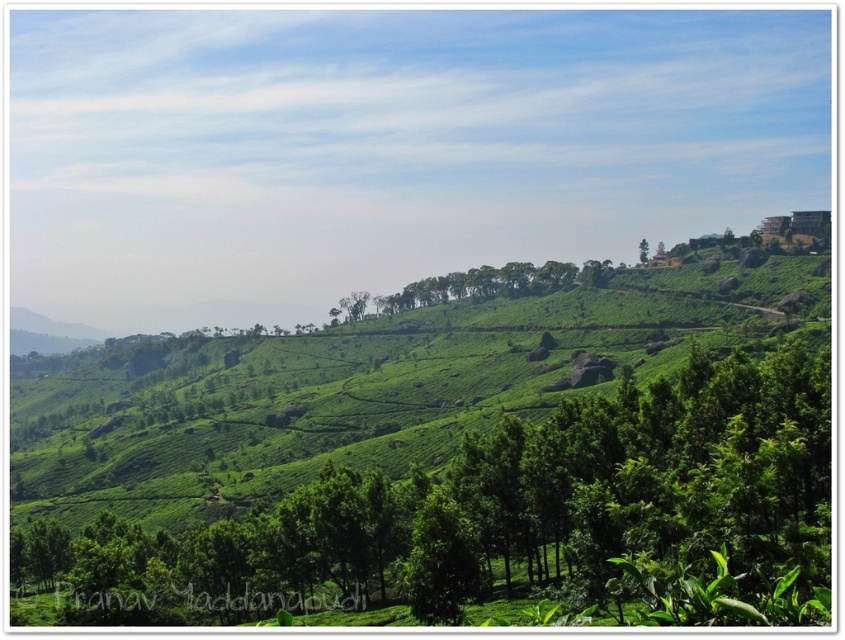
Question: Does green leafy tree at center have a larger size compared to green leafy tree at upper right?

Choices:
 (A) yes
 (B) no

Answer: (B)

Question: Observing the image, what is the correct spatial positioning of green leafy tree at center in reference to green leafy tree at upper right?

Choices:
 (A) right
 (B) left

Answer: (B)

Question: Is green leafy tree at center thinner than green leafy tree at upper right?

Choices:
 (A) yes
 (B) no

Answer: (B)

Question: Which object is closer to the camera taking this photo?

Choices:
 (A) green leafy tree at center
 (B) green leafy tree at upper right

Answer: (A)

Question: Which object is farther from the camera taking this photo?

Choices:
 (A) green leafy tree at upper right
 (B) green leafy tree at center

Answer: (A)